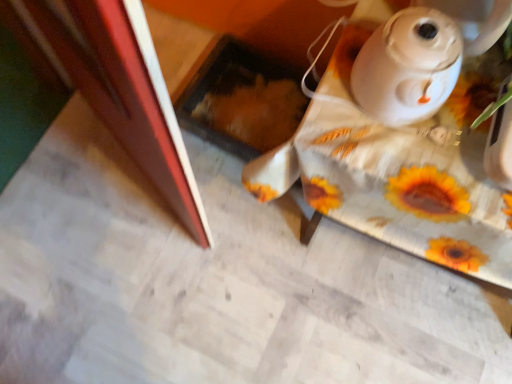
Find the location of `vacant space in front of white glossy kettle at upper right`. vacant space in front of white glossy kettle at upper right is located at coordinates (407, 163).